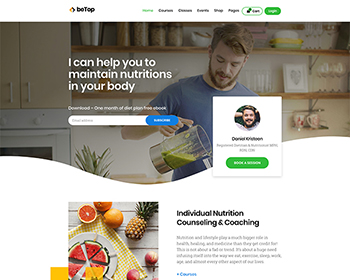
The image size is (350, 280). Identify the location of checked table cloth. 118,260.